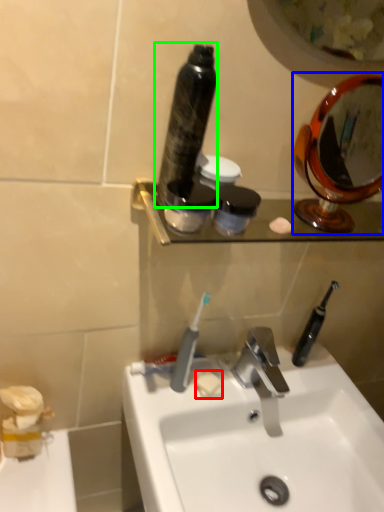
Question: Considering the real-world distances, which object is closest to soap (highlighted by a red box)? mirror (highlighted by a blue box) or mouthwash (highlighted by a green box).

Choices:
 (A) mirror
 (B) mouthwash

Answer: (B)